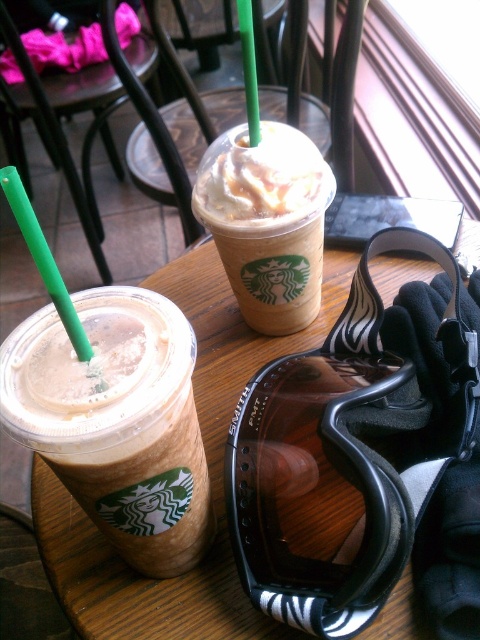
Question: Is wooden table at center further to the viewer compared to caramel frosted cup at center?

Choices:
 (A) yes
 (B) no

Answer: (B)

Question: Estimate the real-world distances between objects in this image. Which object is farther from the iced caramel macchiato at center?

Choices:
 (A) caramel frosted cup at center
 (B) green plastic straw at upper left

Answer: (A)

Question: Which object appears farthest from the camera in this image?

Choices:
 (A) green plastic straw at upper left
 (B) iced caramel macchiato at center

Answer: (B)

Question: Is iced caramel macchiato at center thinner than green plastic straw at upper left?

Choices:
 (A) no
 (B) yes

Answer: (B)

Question: Which of the following is the farthest from the observer?

Choices:
 (A) iced caramel macchiato at center
 (B) caramel frosted cup at center
 (C) green plastic straw at upper center

Answer: (B)

Question: Is iced caramel macchiato at center above wooden table at center?

Choices:
 (A) no
 (B) yes

Answer: (A)